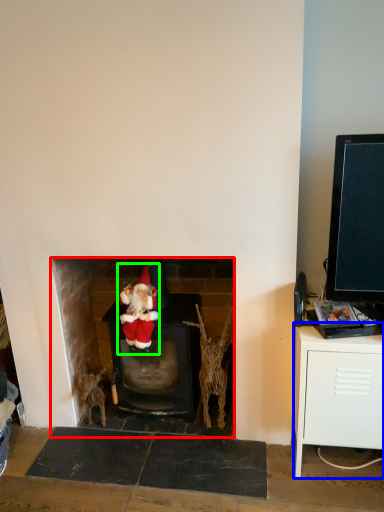
Question: Which object is positioned closest to fireplace (highlighted by a red box)? Select from table (highlighted by a blue box) and person (highlighted by a green box).

Choices:
 (A) table
 (B) person

Answer: (B)